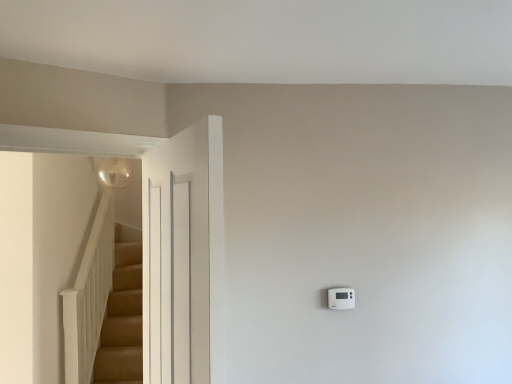
Question: Is white painted wood door at left wider or thinner than white plastic thermostat at right?

Choices:
 (A) thin
 (B) wide

Answer: (B)

Question: Is white painted wood door at left spatially inside white plastic thermostat at right, or outside of it?

Choices:
 (A) outside
 (B) inside

Answer: (A)

Question: From a real-world perspective, is white painted wood door at left physically located above or below white plastic thermostat at right?

Choices:
 (A) above
 (B) below

Answer: (A)

Question: Relative to white painted wood door at left, is white plastic thermostat at right in front or behind?

Choices:
 (A) behind
 (B) front

Answer: (A)

Question: Is white plastic thermostat at right taller or shorter than white painted wood door at left?

Choices:
 (A) tall
 (B) short

Answer: (B)

Question: From a real-world perspective, is white plastic thermostat at right physically located above or below white painted wood door at left?

Choices:
 (A) below
 (B) above

Answer: (A)

Question: Is white plastic thermostat at right spatially inside white painted wood door at left, or outside of it?

Choices:
 (A) outside
 (B) inside

Answer: (A)